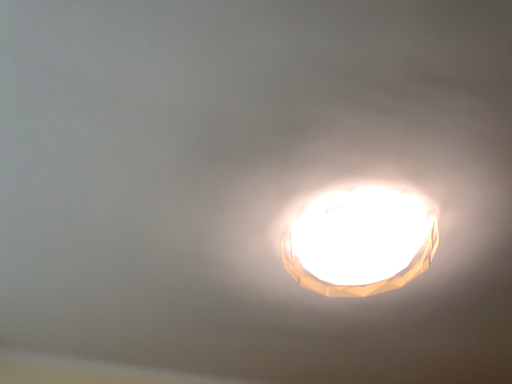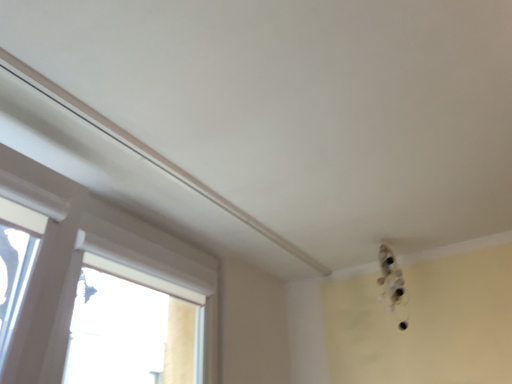
Question: Which way did the camera rotate in the video?

Choices:
 (A) rotated downward
 (B) rotated upward

Answer: (A)